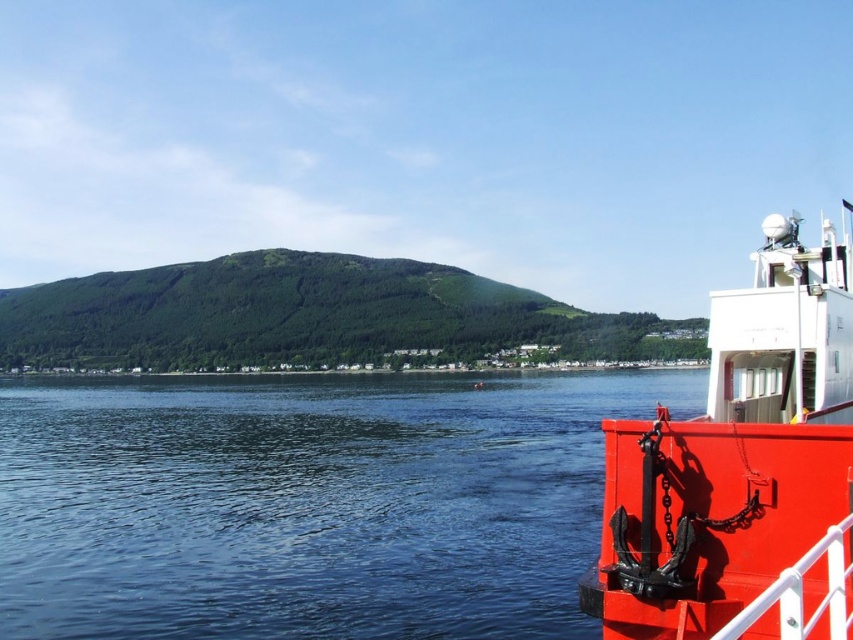
Question: Does metallic red boat at right have a smaller size compared to green forested hill at center?

Choices:
 (A) yes
 (B) no

Answer: (A)

Question: Does clear water at lower right have a smaller size compared to green forested hill at center?

Choices:
 (A) yes
 (B) no

Answer: (A)

Question: Among these points, which one is nearest to the camera?

Choices:
 (A) click(x=306, y=285)
 (B) click(x=83, y=497)

Answer: (B)

Question: Which point is farther to the camera?

Choices:
 (A) clear water at lower right
 (B) green forested hill at center
 (C) metallic red boat at right

Answer: (B)

Question: Among these points, which one is nearest to the camera?

Choices:
 (A) (490, 324)
 (B) (846, 464)
 (C) (16, 380)

Answer: (B)

Question: Can you confirm if metallic red boat at right is thinner than green forested hill at center?

Choices:
 (A) yes
 (B) no

Answer: (A)